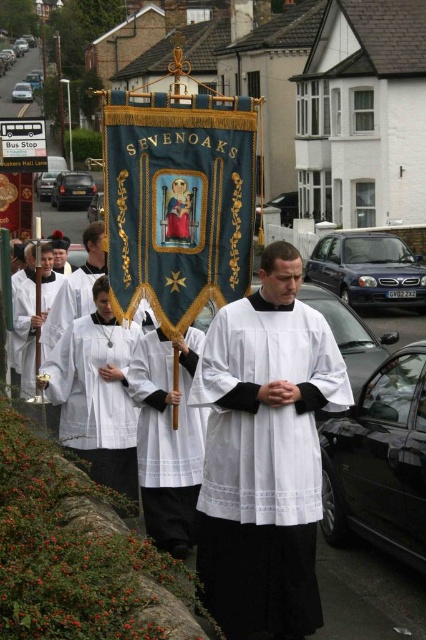
You are a photographer trying to capture the banner in the procession. You notice two white items at the center of the scene, the white smooth fabric at center and the white matte robe at center. Which one is taller?

The white smooth fabric at center is taller than the white matte robe at center.